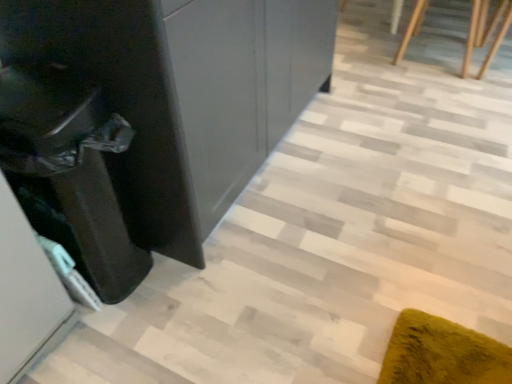
Find the location of a particular element. The width and height of the screenshot is (512, 384). glossy black dresser at left is located at coordinates (149, 118).

Find the location of `wooden staircase at upper right`. wooden staircase at upper right is located at coordinates (485, 31).

Image resolution: width=512 pixels, height=384 pixels. I want to click on glossy black dresser at left, so click(149, 118).

Could glossy black dresser at left be considered to be inside wooden staircase at upper right?

No.

Based on the photo, between wooden staircase at upper right and glossy black dresser at left, which one has more height?

glossy black dresser at left.

Locate an element on the screen. The height and width of the screenshot is (384, 512). furniture below the glossy black dresser at left (from a real-world perspective) is located at coordinates (485, 31).

Can you confirm if wooden staircase at upper right is thinner than glossy black dresser at left?

Yes, wooden staircase at upper right is thinner than glossy black dresser at left.

From a real-world perspective, which is physically above, black glossy cabinet at left or glossy black dresser at left?

glossy black dresser at left, from a real-world perspective.

Is black glossy cabinet at left to the left of glossy black dresser at left from the viewer's perspective?

Indeed, black glossy cabinet at left is positioned on the left side of glossy black dresser at left.

Where is `dresser above the black glossy cabinet at left (from the image's perspective)`? dresser above the black glossy cabinet at left (from the image's perspective) is located at coordinates (149, 118).

Is black glossy cabinet at left in contact with glossy black dresser at left?

They are not placed beside each other.

Based on the photo, in terms of size, does wooden staircase at upper right appear bigger or smaller than black glossy cabinet at left?

In the image, wooden staircase at upper right appears to be larger than black glossy cabinet at left.

Which object is positioned more to the right, wooden staircase at upper right or black glossy cabinet at left?

wooden staircase at upper right.

In order to click on cabinetry lying in front of the wooden staircase at upper right in this screenshot , I will do `click(69, 171)`.

In the scene shown: Which object is more forward, wooden staircase at upper right or black glossy cabinet at left?

black glossy cabinet at left.

Is glossy black dresser at left placed right next to black glossy cabinet at left?

No, glossy black dresser at left is not with black glossy cabinet at left.

Can you confirm if glossy black dresser at left is thinner than black glossy cabinet at left?

In fact, glossy black dresser at left might be wider than black glossy cabinet at left.

Is point (267, 60) positioned before point (99, 223)?

No, (267, 60) is behind (99, 223).

Do you think glossy black dresser at left is within black glossy cabinet at left, or outside of it?

glossy black dresser at left is outside black glossy cabinet at left.

Is glossy black dresser at left aimed at wooden staircase at upper right?

No, glossy black dresser at left is not facing towards wooden staircase at upper right.

Based on the photo, from the image's perspective, is glossy black dresser at left on wooden staircase at upper right?

No, from the image's perspective, glossy black dresser at left is not on top of wooden staircase at upper right.

Considering the points (35, 183) and (400, 49), which point is in front, point (35, 183) or point (400, 49)?

Positioned in front is point (35, 183).

Is black glossy cabinet at left bigger than wooden staircase at upper right?

No, black glossy cabinet at left is not bigger than wooden staircase at upper right.

Is black glossy cabinet at left not near wooden staircase at upper right?

black glossy cabinet at left is positioned a significant distance from wooden staircase at upper right.

Can you tell me how much black glossy cabinet at left and wooden staircase at upper right differ in facing direction?

The facing directions of black glossy cabinet at left and wooden staircase at upper right are 90.3 degrees apart.

Find the location of `dresser located in front of the wooden staircase at upper right`. dresser located in front of the wooden staircase at upper right is located at coordinates (149, 118).

Locate an element on the screen. This screenshot has height=384, width=512. dresser that is on the right side of black glossy cabinet at left is located at coordinates (149, 118).

Consider the image. Based on their spatial positions, is glossy black dresser at left or wooden staircase at upper right further from black glossy cabinet at left?

Among the two, wooden staircase at upper right is located further to black glossy cabinet at left.

Consider the image. Estimate the real-world distances between objects in this image. Which object is further from wooden staircase at upper right, black glossy cabinet at left or glossy black dresser at left?

Based on the image, black glossy cabinet at left appears to be further to wooden staircase at upper right.

From the picture: Considering their positions, is black glossy cabinet at left positioned further to glossy black dresser at left than wooden staircase at upper right?

Among the two, wooden staircase at upper right is located further to glossy black dresser at left.

Considering their positions, is wooden staircase at upper right positioned further to glossy black dresser at left than black glossy cabinet at left?

Among the two, wooden staircase at upper right is located further to glossy black dresser at left.

Based on their spatial positions, is wooden staircase at upper right or glossy black dresser at left closer to black glossy cabinet at left?

glossy black dresser at left is positioned closer to the anchor black glossy cabinet at left.

Considering their positions, is glossy black dresser at left positioned closer to wooden staircase at upper right than black glossy cabinet at left?

glossy black dresser at left.

Identify the location of dresser between black glossy cabinet at left and wooden staircase at upper right from left to right. (149, 118).